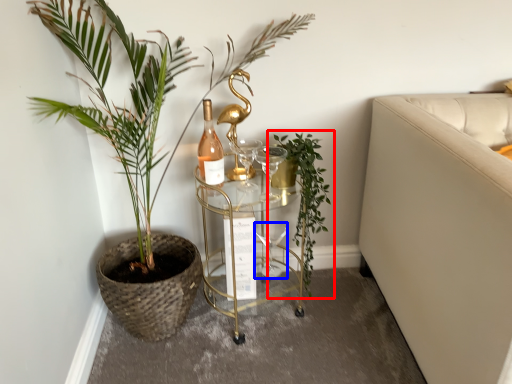
Question: Among these objects, which one is farthest to the camera, houseplant (highlighted by a red box) or wine glass (highlighted by a blue box)?

Choices:
 (A) houseplant
 (B) wine glass

Answer: (B)